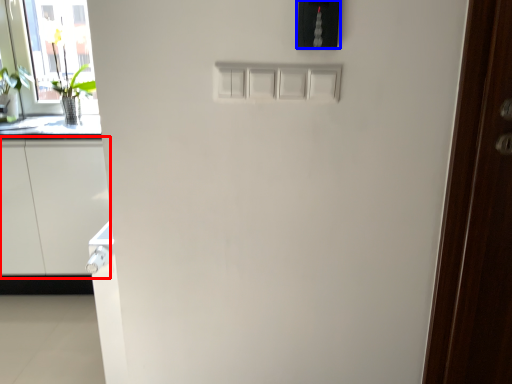
Question: Among these objects, which one is farthest to the camera, cabinetry (highlighted by a red box) or light switch (highlighted by a blue box)?

Choices:
 (A) cabinetry
 (B) light switch

Answer: (A)